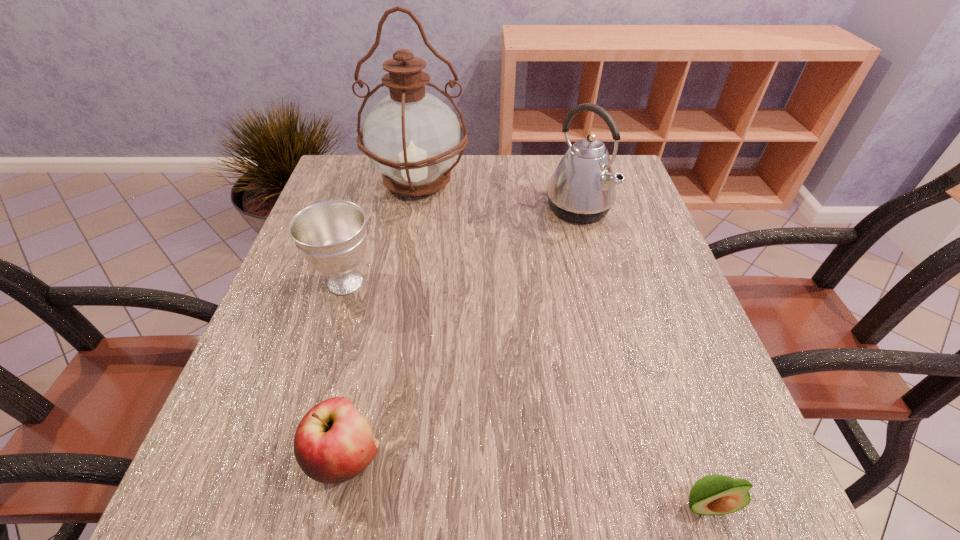
Image resolution: width=960 pixels, height=540 pixels. Identify the location of the tallest object. (413, 138).

This screenshot has width=960, height=540. What are the coordinates of `the fourth shortest object` in the screenshot? It's located at (582, 189).

This screenshot has width=960, height=540. What are the coordinates of `chalice` in the screenshot? It's located at (331, 235).

Locate an element on the screen. The image size is (960, 540). the third shortest object is located at coordinates (331, 235).

The height and width of the screenshot is (540, 960). I want to click on apple, so click(x=333, y=443).

In order to click on avocado in this screenshot , I will do `click(715, 494)`.

At what (x,y) coordinates should I click in order to perform the action: click on free space located on the right of the tallest object. Please return your answer as a coordinate pair (x, y). The width and height of the screenshot is (960, 540). Looking at the image, I should click on (606, 182).

I want to click on vacant space located on the left of the fourth shortest object, so click(488, 208).

Find the location of a particular element. The image size is (960, 540). vacant area situated 0.080m on the right of the third nearest object is located at coordinates (418, 282).

Locate an element on the screen. The width and height of the screenshot is (960, 540). free space located 0.240m on the right of the apple is located at coordinates (546, 457).